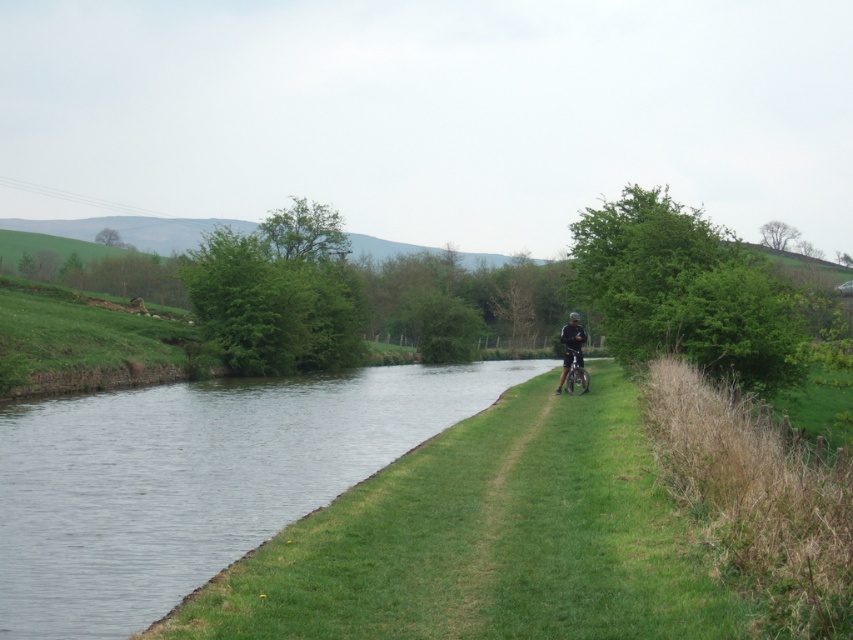
Who is more distant from viewer, (126, 420) or (569, 348)?

Positioned behind is point (569, 348).

Does point (73, 600) come behind point (572, 317)?

No, (73, 600) is closer to viewer.

Identify the location of clear water at right. This screenshot has width=853, height=640. (194, 480).